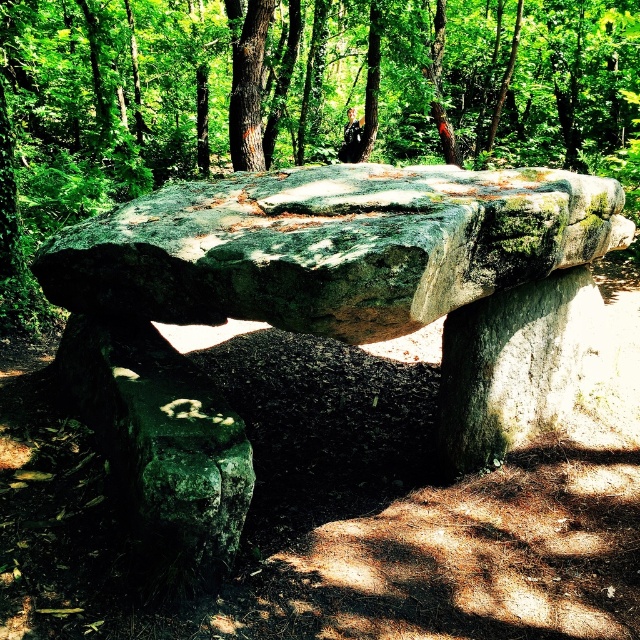
Which of these two, green mossy stone bench at center or green mossy rock at center, stands taller?

Standing taller between the two is green mossy rock at center.

Does point (200, 384) come closer to viewer compared to point (166, 67)?

Yes, it is in front of point (166, 67).

Locate an element on the screen. The image size is (640, 640). green mossy stone bench at center is located at coordinates (321, 310).